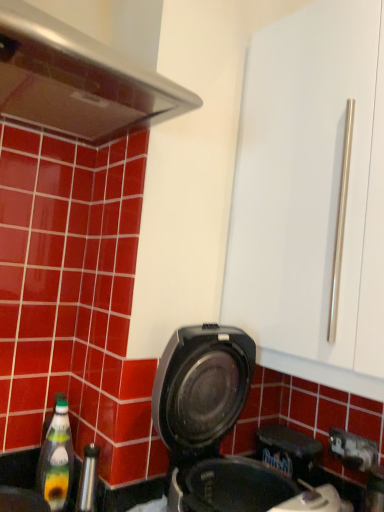
The height and width of the screenshot is (512, 384). Describe the element at coordinates (210, 421) in the screenshot. I see `black plastic waffle maker at lower center` at that location.

Where is `black plastic waffle maker at lower center`? black plastic waffle maker at lower center is located at coordinates (210, 421).

This screenshot has width=384, height=512. What do you see at coordinates (56, 459) in the screenshot?
I see `green glass bottle at lower left` at bounding box center [56, 459].

At what (x,y) coordinates should I click in order to perform the action: click on green glass bottle at lower left. Please return your answer as a coordinate pair (x, y). The image size is (384, 512). Looking at the image, I should click on (56, 459).

Where is `black plastic waffle maker at lower center`? The width and height of the screenshot is (384, 512). black plastic waffle maker at lower center is located at coordinates (210, 421).

Is transparent plastic bottle at lower left next to black plastic waffle maker at lower center?

No.

Is transparent plastic bottle at lower left bigger or smaller than black plastic waffle maker at lower center?

Clearly, transparent plastic bottle at lower left is smaller in size than black plastic waffle maker at lower center.

Is transparent plastic bottle at lower left turned away from black plastic waffle maker at lower center?

transparent plastic bottle at lower left is not turned away from black plastic waffle maker at lower center.

Between transparent plastic bottle at lower left and green glass bottle at lower left, which one appears on the left side from the viewer's perspective?

Answer: From the viewer's perspective, transparent plastic bottle at lower left appears more on the left side.

Consider the image. From the image's perspective, which one is positioned higher, transparent plastic bottle at lower left or green glass bottle at lower left?

green glass bottle at lower left is shown above in the image.

From a real-world perspective, between transparent plastic bottle at lower left and green glass bottle at lower left, who is vertically higher?

green glass bottle at lower left is physically above.

Between transparent plastic bottle at lower left and green glass bottle at lower left, which one has smaller size?

green glass bottle at lower left.

Consider the image. Is black plastic waffle maker at lower center not within green glass bottle at lower left?

Absolutely, black plastic waffle maker at lower center is external to green glass bottle at lower left.

Looking at this image, from a real-world perspective, is black plastic waffle maker at lower center positioned under green glass bottle at lower left based on gravity?

No, from a real-world perspective, black plastic waffle maker at lower center is not below green glass bottle at lower left.

Is black plastic waffle maker at lower center positioned far away from green glass bottle at lower left?

No.

From the image's perspective, does black plastic waffle maker at lower center appear higher than green glass bottle at lower left?

Yes, from the image's perspective, black plastic waffle maker at lower center is on top of green glass bottle at lower left.

Does green glass bottle at lower left have a smaller size compared to transparent plastic bottle at lower left?

Correct, green glass bottle at lower left occupies less space than transparent plastic bottle at lower left.

From the image's perspective, which one is positioned lower, green glass bottle at lower left or transparent plastic bottle at lower left?

transparent plastic bottle at lower left is shown below in the image.

Which is behind, point (40, 490) or point (74, 510)?

Point (40, 490)

Is green glass bottle at lower left with transparent plastic bottle at lower left?

Yes, green glass bottle at lower left is beside transparent plastic bottle at lower left.

Is black plastic waffle maker at lower center at the back of green glass bottle at lower left?

No.

In the image, is green glass bottle at lower left on the left side or the right side of black plastic waffle maker at lower center?

green glass bottle at lower left is positioned on black plastic waffle maker at lower center's left side.

Considering the positions of point (42, 459) and point (207, 374), is point (42, 459) closer or farther from the camera than point (207, 374)?

Point (42, 459) appears to be farther away from the viewer than point (207, 374).

Is black plastic waffle maker at lower center aimed at transparent plastic bottle at lower left?

No, black plastic waffle maker at lower center is not turned towards transparent plastic bottle at lower left.

Are black plastic waffle maker at lower center and transparent plastic bottle at lower left located far from each other?

No, there isn't a large distance between black plastic waffle maker at lower center and transparent plastic bottle at lower left.

Which object is further away from the camera taking this photo, black plastic waffle maker at lower center or transparent plastic bottle at lower left?

transparent plastic bottle at lower left is further away from the camera.

Image resolution: width=384 pixels, height=512 pixels. Identify the location of kitchen appliance that appears above the transparent plastic bottle at lower left (from a real-world perspective). (210, 421).

What are the coordinates of `sink to the left of green glass bottle at lower left` in the screenshot? It's located at (19, 468).

Based on their spatial positions, is green glass bottle at lower left or black plastic waffle maker at lower center closer to transparent plastic bottle at lower left?

green glass bottle at lower left lies closer to transparent plastic bottle at lower left than the other object.

Based on their spatial positions, is black plastic waffle maker at lower center or transparent plastic bottle at lower left further from green glass bottle at lower left?

black plastic waffle maker at lower center lies further to green glass bottle at lower left than the other object.

Which object lies further to the anchor point green glass bottle at lower left, transparent plastic bottle at lower left or black plastic waffle maker at lower center?

Based on the image, black plastic waffle maker at lower center appears to be further to green glass bottle at lower left.

When comparing their distances from black plastic waffle maker at lower center, does transparent plastic bottle at lower left or green glass bottle at lower left seem further?

green glass bottle at lower left is positioned further to the anchor black plastic waffle maker at lower center.

Based on their spatial positions, is green glass bottle at lower left or transparent plastic bottle at lower left closer to black plastic waffle maker at lower center?

The object closer to black plastic waffle maker at lower center is transparent plastic bottle at lower left.

Considering their positions, is black plastic waffle maker at lower center positioned closer to transparent plastic bottle at lower left than green glass bottle at lower left?

Based on the image, green glass bottle at lower left appears to be nearer to transparent plastic bottle at lower left.

At what (x,y) coordinates should I click in order to perform the action: click on bottle between transparent plastic bottle at lower left and black plastic waffle maker at lower center in the horizontal direction. Please return your answer as a coordinate pair (x, y). The image size is (384, 512). Looking at the image, I should click on (56, 459).